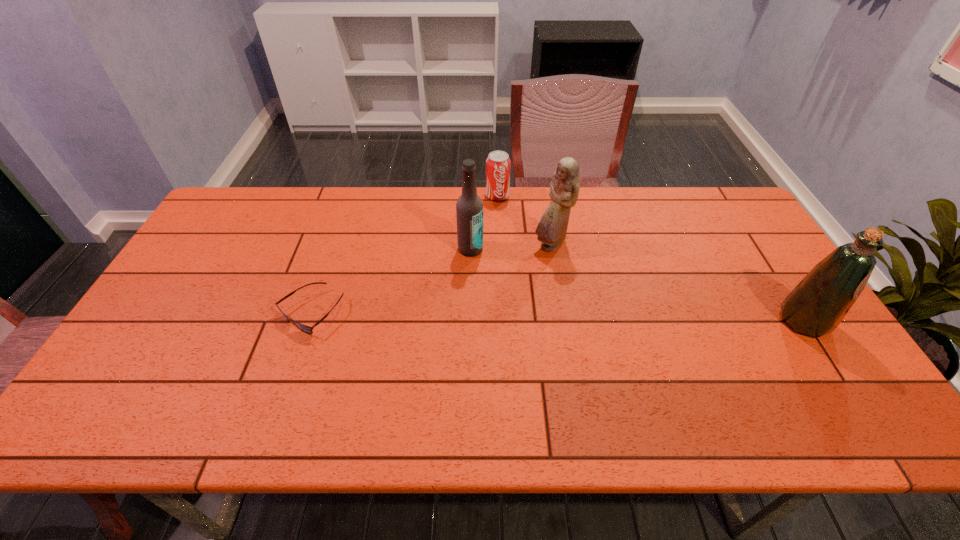
At what (x,y) coordinates should I click in order to perform the action: click on blank space located on the front-facing side of the figurine. Please return your answer as a coordinate pair (x, y). This screenshot has height=540, width=960. Looking at the image, I should click on (531, 342).

What are the coordinates of `vacant space located on the logo side of the fourth tallest object` in the screenshot? It's located at (514, 256).

You are a GUI agent. You are given a task and a screenshot of the screen. Output one action in this format:
    pyautogui.click(x=<x>, y=<y>)
    Task: Click on the vacant point located on the logo side of the fourth tallest object
    This screenshot has width=960, height=540.
    Given the screenshot: What is the action you would take?
    pyautogui.click(x=502, y=215)

Identify the location of vacant area situated 0.110m on the logo side of the fourth tallest object. [x=504, y=223].

Find the location of a particular element. free point located 0.350m on the label of the second object from left to right is located at coordinates (512, 350).

Where is `free space located on the label of the second object from left to right`? The image size is (960, 540). free space located on the label of the second object from left to right is located at coordinates (516, 360).

Identify the location of vacant space located 0.320m on the label of the second object from left to right. click(508, 340).

Identify the location of object that is at the far edge. (498, 164).

The height and width of the screenshot is (540, 960). What are the coordinates of `object at the right edge` in the screenshot? It's located at (816, 306).

The width and height of the screenshot is (960, 540). Find the location of `vacant space at the far edge of the desktop`. vacant space at the far edge of the desktop is located at coordinates (511, 204).